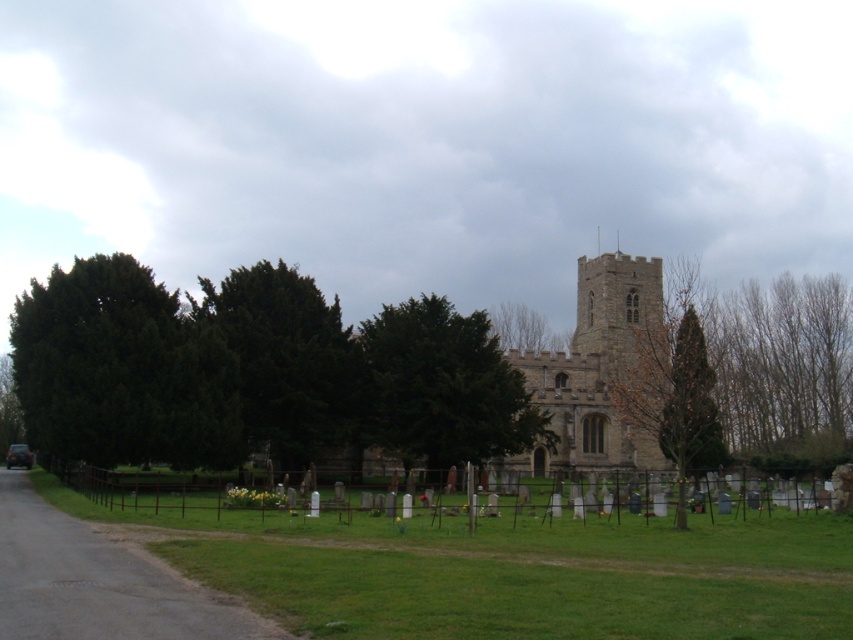
Question: Which point is closer to the camera?

Choices:
 (A) gray stone church at center
 (B) dark green textured tree at center

Answer: (A)

Question: Does green leafy tree at center appear under bare branches at upper center?

Choices:
 (A) no
 (B) yes

Answer: (B)

Question: Which object is the farthest from the bare wood at right?

Choices:
 (A) gray stone church at center
 (B) bare branches at upper center
 (C) green leafy tree at left
 (D) green leafy tree at center

Answer: (C)

Question: Observing the image, what is the correct spatial positioning of gray stone church at center in reference to dark green textured tree at center?

Choices:
 (A) below
 (B) above

Answer: (A)

Question: Does green leafy tree at center appear under bare branches at upper center?

Choices:
 (A) yes
 (B) no

Answer: (A)

Question: Considering the real-world distances, which object is farthest from the bare wood at right?

Choices:
 (A) dark green textured tree at center
 (B) green leafy tree at left

Answer: (B)